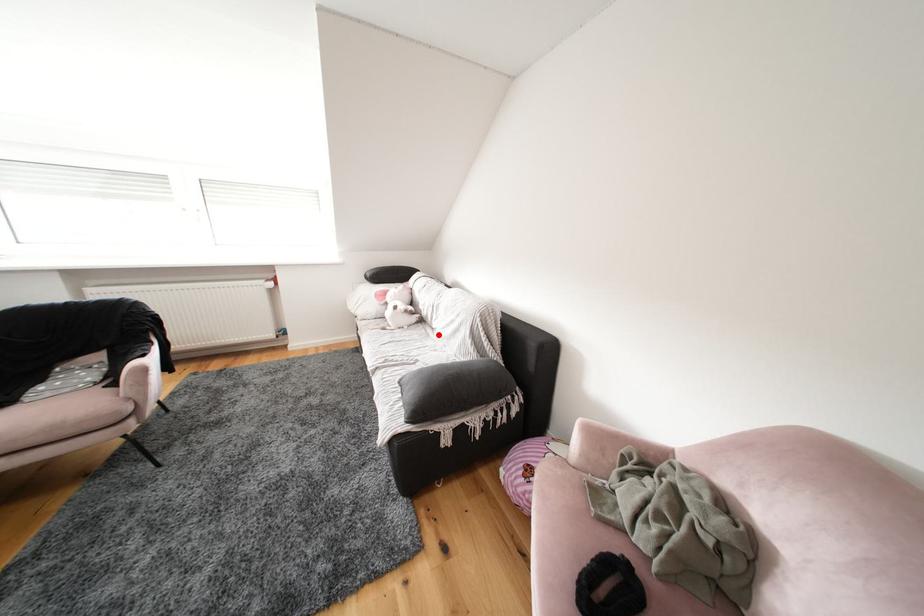
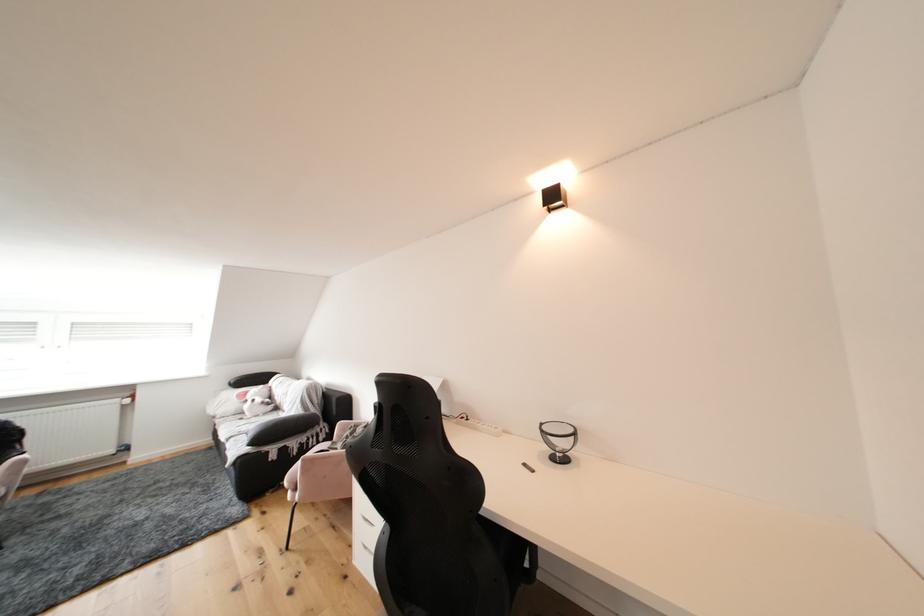
Question: I am providing you with two images of the same scene from different viewpoints. A red point is shown in image1. For the corresponding object point in image2, is it positioned nearer or farther from the camera?

Choices:
 (A) Nearer
 (B) Farther

Answer: (B)